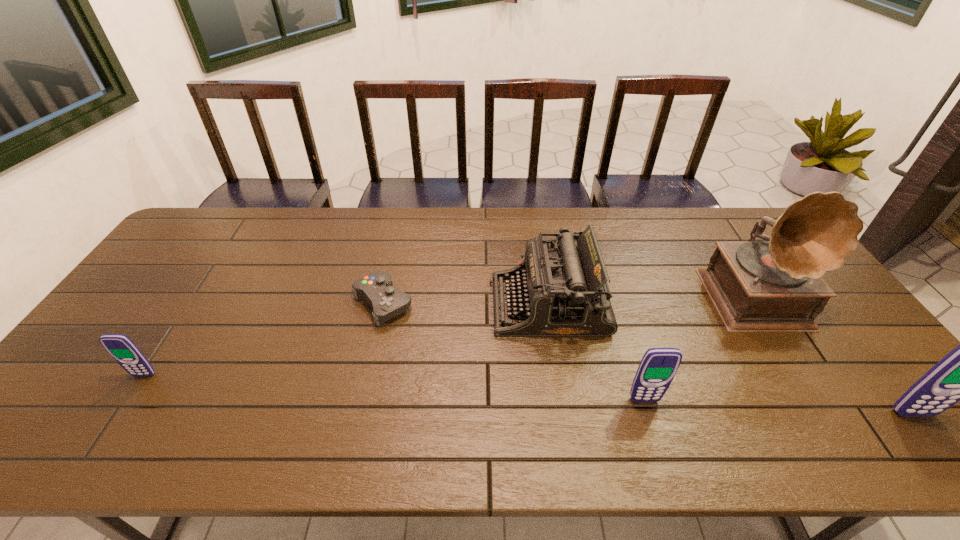
Find the location of a particular element. This screenshot has height=540, width=960. vacant space at the far edge is located at coordinates (313, 215).

The image size is (960, 540). I want to click on free region at the near edge of the desktop, so click(x=806, y=413).

Where is `blank space at the left edge`? blank space at the left edge is located at coordinates (143, 308).

In the image, there is a desktop. Find the location of `free space at the far left corner`. free space at the far left corner is located at coordinates (175, 249).

Where is `unoccupied area between the record player and the typewriter`? unoccupied area between the record player and the typewriter is located at coordinates (656, 301).

This screenshot has height=540, width=960. What are the coordinates of `vacant space in between the typewriter and the shortest object` in the screenshot? It's located at (466, 304).

Image resolution: width=960 pixels, height=540 pixels. What are the coordinates of `vacant area between the typewriter and the record player` in the screenshot? It's located at (656, 301).

Locate an element on the screen. This screenshot has height=540, width=960. vacant space in between the typewriter and the tallest object is located at coordinates (656, 301).

What are the coordinates of `vacant space in between the typewriter and the second farthest cellular telephone` in the screenshot? It's located at (596, 353).

Where is `vacant point located between the second shortest cellular telephone and the nearest cellular telephone`? The image size is (960, 540). vacant point located between the second shortest cellular telephone and the nearest cellular telephone is located at coordinates (779, 407).